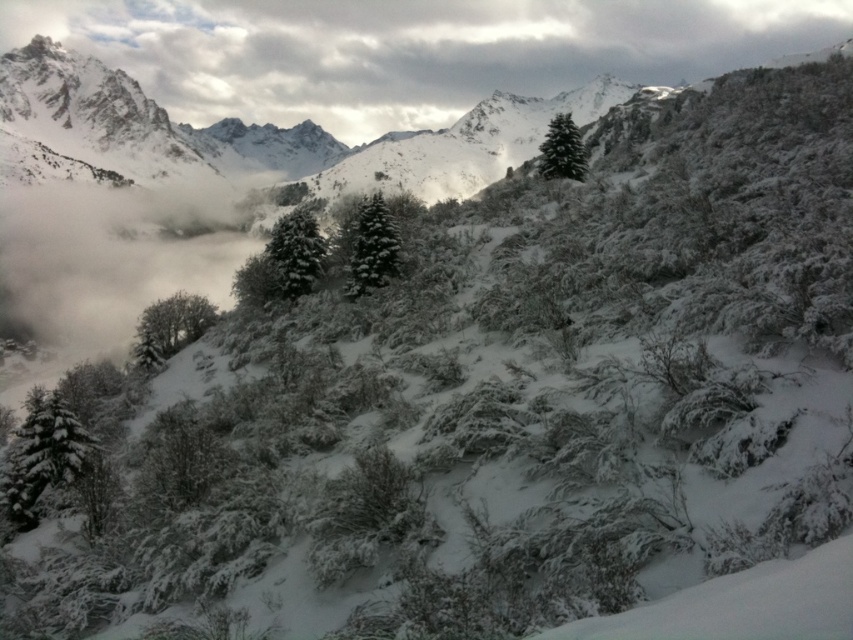
Is point (94, 442) positioned before point (585, 170)?

Yes, it is in front of point (585, 170).

Describe the element at coordinates (44, 456) in the screenshot. I see `snow-covered evergreen tree at lower left` at that location.

Between point (30, 499) and point (566, 118), which one is positioned in front?

Positioned in front is point (30, 499).

This screenshot has height=640, width=853. What are the coordinates of `snow-covered evergreen tree at lower left` in the screenshot? It's located at (44, 456).

Does white fluffy cloud at upper center have a greater width compared to green matte tree at center?

Indeed, white fluffy cloud at upper center has a greater width compared to green matte tree at center.

Based on the photo, can you confirm if white fluffy cloud at upper center is thinner than green matte tree at center?

No, white fluffy cloud at upper center is not thinner than green matte tree at center.

Between point (575, 12) and point (314, 221), which one is positioned behind?

The point (575, 12) is more distant.

Locate an element on the screen. Image resolution: width=853 pixels, height=640 pixels. white fluffy cloud at upper center is located at coordinates (410, 49).

Does green matte tree at center come in front of green matte evergreen tree at upper center?

Yes.

Between green matte tree at center and green matte evergreen tree at upper center, which one is positioned higher?

green matte evergreen tree at upper center

What do you see at coordinates (296, 252) in the screenshot? I see `green matte tree at center` at bounding box center [296, 252].

The width and height of the screenshot is (853, 640). I want to click on green matte tree at center, so click(x=296, y=252).